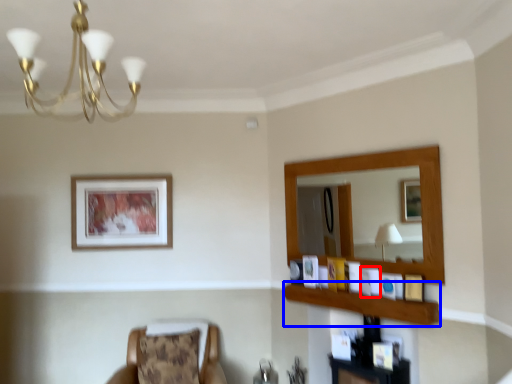
Question: Which object appears farthest to the camera in this image, picture frame (highlighted by a red box) or balustrade (highlighted by a blue box)?

Choices:
 (A) picture frame
 (B) balustrade

Answer: (A)